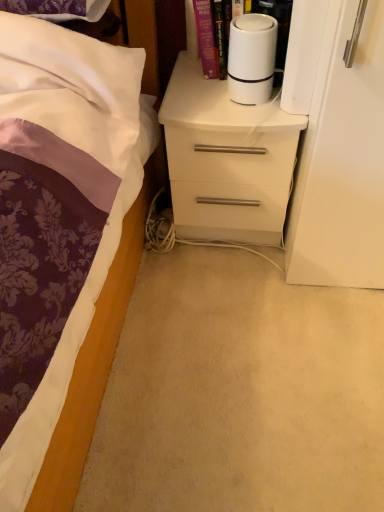
You are a GUI agent. You are given a task and a screenshot of the screen. Output one action in this format:
    pyautogui.click(x=<x>, y=<y>)
    Task: Click on the free point above white glossy chest of drawers at center (from a real-world perspective)
    Image resolution: width=384 pixels, height=512 pixels.
    Given the screenshot: What is the action you would take?
    pyautogui.click(x=215, y=94)